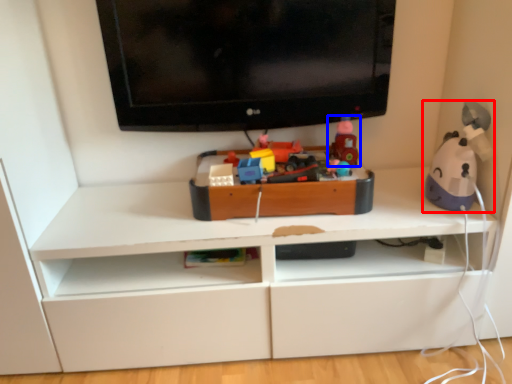
Question: Which object is further to the camera taking this photo, toy (highlighted by a red box) or toy (highlighted by a blue box)?

Choices:
 (A) toy
 (B) toy

Answer: (B)